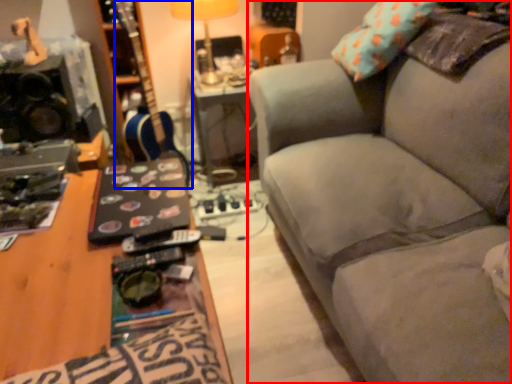
Question: Which of the following is the farthest to the observer, studio couch (highlighted by a red box) or guitar (highlighted by a blue box)?

Choices:
 (A) studio couch
 (B) guitar

Answer: (B)